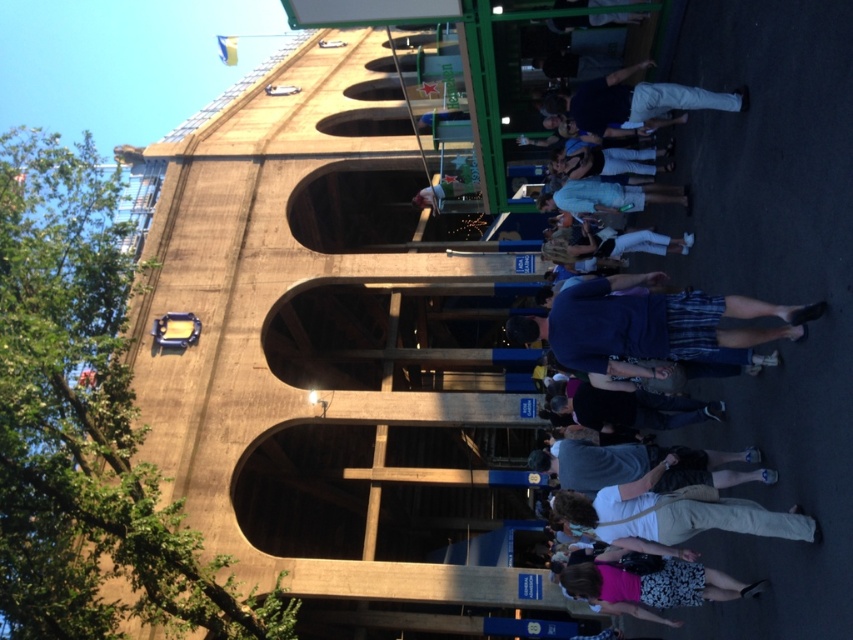
Does white cotton pants at center appear over floral skirt at lower right?

Yes, white cotton pants at center is above floral skirt at lower right.

Between white cotton pants at center and floral skirt at lower right, which one is positioned higher?

white cotton pants at center is above.

Is point (793, 465) closer to camera compared to point (637, 577)?

Yes, it is.

Locate an element on the screen. The width and height of the screenshot is (853, 640). white cotton pants at center is located at coordinates (775, 288).

Does white cotton pants at center appear over light blue denim shorts at center?

Actually, white cotton pants at center is below light blue denim shorts at center.

Looking at this image, can you confirm if white cotton pants at center is bigger than light blue denim shorts at center?

Indeed, white cotton pants at center has a larger size compared to light blue denim shorts at center.

From the picture: Who is more forward, (824, 616) or (666, 188)?

Positioned in front is point (824, 616).

You are a GUI agent. You are given a task and a screenshot of the screen. Output one action in this format:
    pyautogui.click(x=<x>, y=<y>)
    Task: Click on the white cotton pants at center
    The image size is (853, 640).
    Given the screenshot: What is the action you would take?
    pyautogui.click(x=775, y=288)

Who is taller, floral skirt at lower right or light blue denim shorts at center?

Standing taller between the two is floral skirt at lower right.

Does point (621, 598) come closer to viewer compared to point (595, 205)?

Yes, point (621, 598) is in front of point (595, 205).

Identify the location of floral skirt at lower right. The height and width of the screenshot is (640, 853). (651, 588).